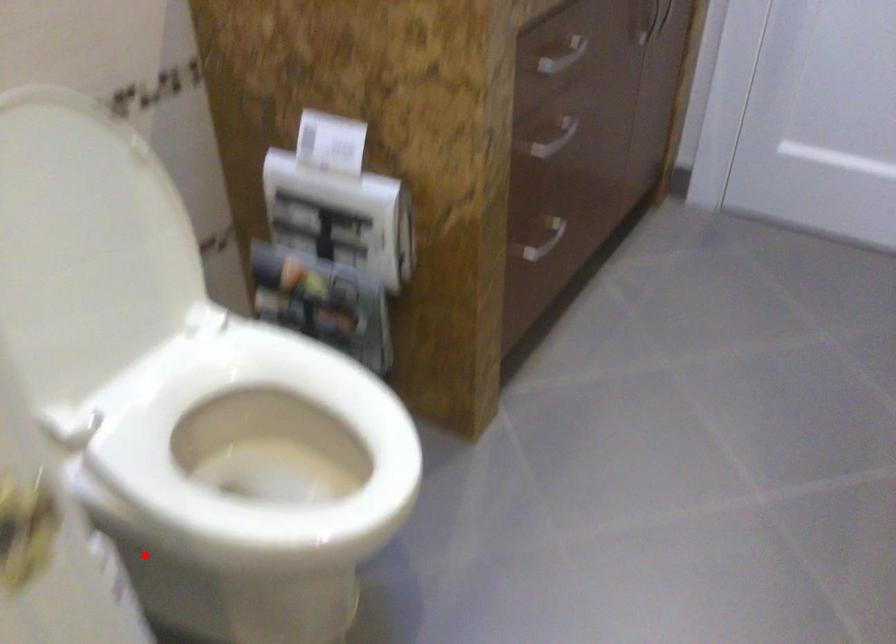
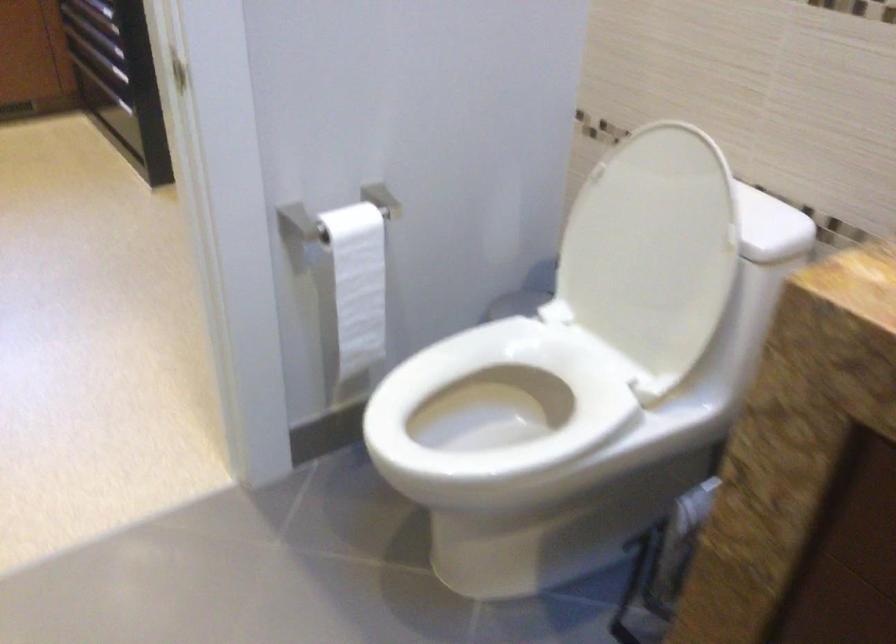
Find the pixel in the second image that matches the highlighted location in the first image.

(497, 413)